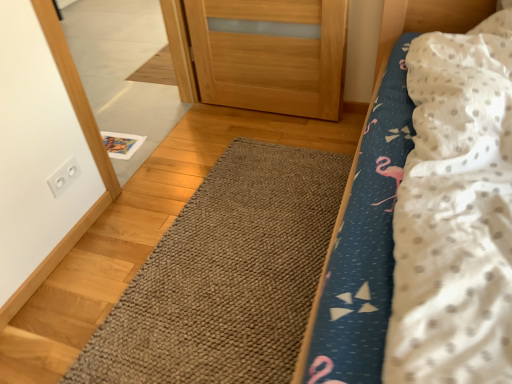
Where is `free space to the back side of brown textured rug at center`? The height and width of the screenshot is (384, 512). free space to the back side of brown textured rug at center is located at coordinates (229, 141).